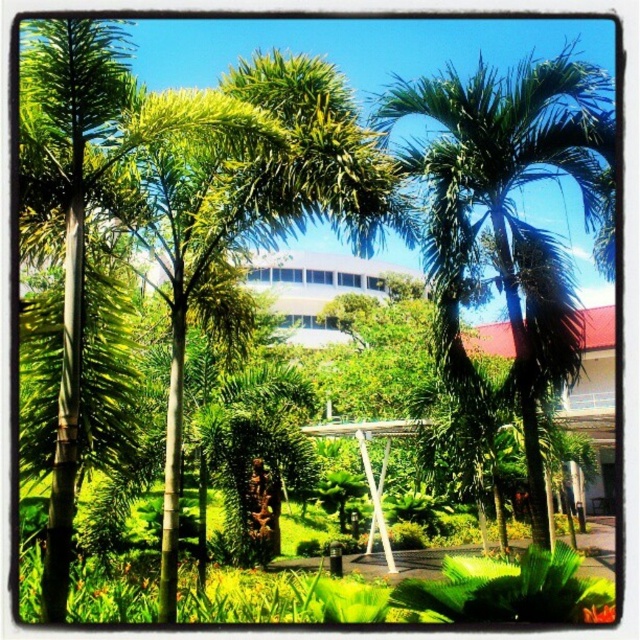
Question: Which object is closer to the camera taking this photo?

Choices:
 (A) green leafy palm tree at left
 (B) green leafy palm tree at center

Answer: (A)

Question: Which of the following is the farthest from the observer?

Choices:
 (A) green leafy palm tree at left
 (B) green leafy palm tree at center

Answer: (B)

Question: Considering the relative positions of green leafy palm tree at center and green leafy palm tree at left in the image provided, where is green leafy palm tree at center located with respect to green leafy palm tree at left?

Choices:
 (A) below
 (B) above

Answer: (B)

Question: Can you confirm if green leafy palm tree at center is positioned above green leafy palm tree at left?

Choices:
 (A) yes
 (B) no

Answer: (A)

Question: Does green leafy palm tree at center appear under green leafy palm tree at left?

Choices:
 (A) yes
 (B) no

Answer: (B)